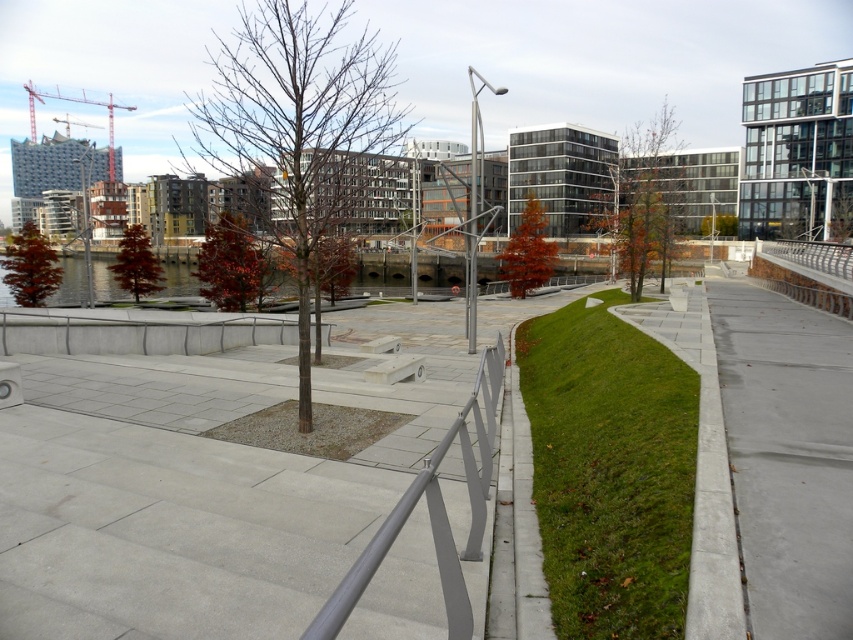
You are a gardener planning to water both the red glossy tree at center and the orange matte tree at center. Since you can only water one at a time, which tree should you water first to ensure the water reaches it without being blocked by the other?

The red glossy tree at center should be watered first because it is positioned under the orange matte tree at center, so watering the upper tree first prevents water from being blocked by the lower one.

You are a gardener planning to install a new bench along the paved walkway in the urban park. The bench requires a minimum of 2 meters of space to be placed. Given the gray concrete pavement at center and the bare wood tree at center, which object has a width that might be insufficient for placing the bench?

The gray concrete pavement at center has a width less than the bare wood tree at center, so the gray concrete pavement at center might be insufficient for placing the bench since it requires at least 2 meters of space.